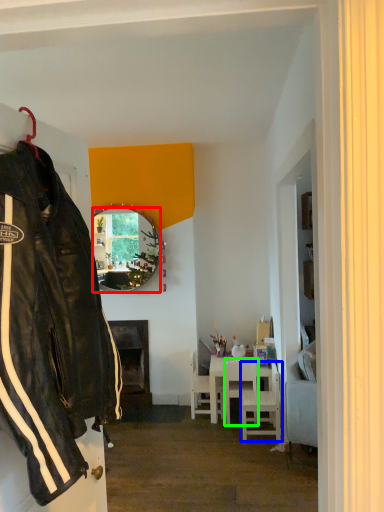
Question: Based on their relative distances, which object is farther from mirror (highlighted by a red box)? Choose from chair (highlighted by a blue box) and chair (highlighted by a green box).

Choices:
 (A) chair
 (B) chair

Answer: (A)